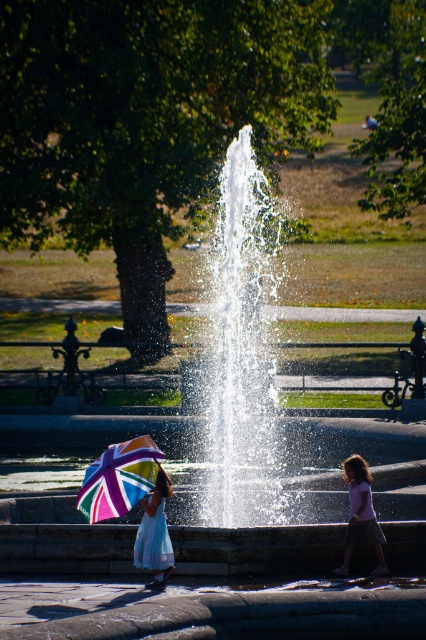
Question: Among these points, which one is farthest from the camera?

Choices:
 (A) (149, 525)
 (B) (104, 480)

Answer: (B)

Question: Which object appears farthest from the camera in this image?

Choices:
 (A) pink cotton shirt at center
 (B) rainbow-patterned fabric umbrella at left

Answer: (A)

Question: Considering the real-world distances, which object is farthest from the light blue satin dress at lower left?

Choices:
 (A) pink cotton shirt at center
 (B) rainbow-patterned fabric umbrella at left

Answer: (A)

Question: Can you confirm if rainbow-patterned fabric umbrella at left is positioned below light blue satin dress at lower left?

Choices:
 (A) yes
 (B) no

Answer: (B)

Question: Is the position of rainbow-patterned fabric umbrella at left less distant than that of light blue satin dress at lower left?

Choices:
 (A) no
 (B) yes

Answer: (A)

Question: Does pink cotton shirt at center lie behind light blue satin dress at lower left?

Choices:
 (A) yes
 (B) no

Answer: (A)